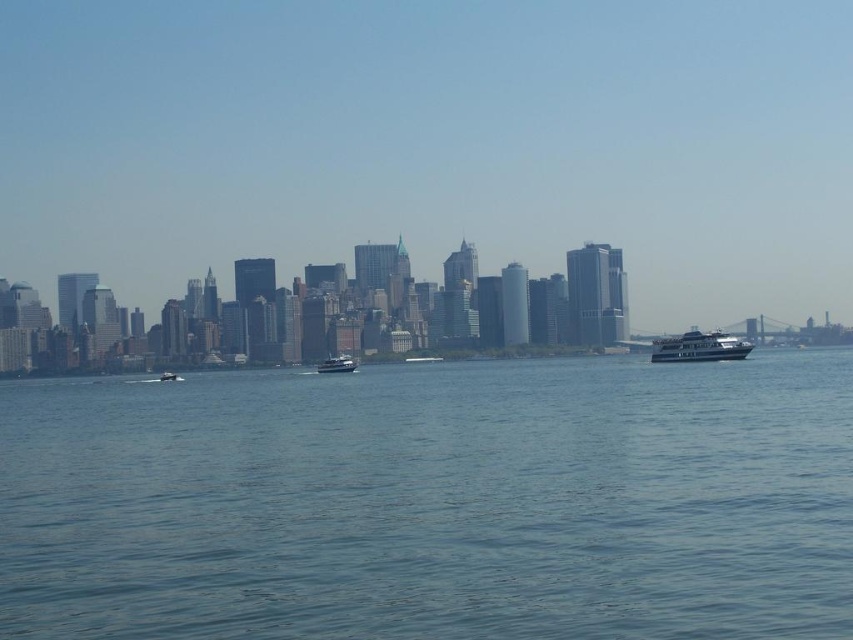
Can you confirm if white glossy ferry at right is taller than metallic silver boat at center-left?

Yes.

Which is in front, point (743, 353) or point (161, 372)?

Point (743, 353) is more forward.

Identify the location of white glossy ferry at right. (699, 348).

The width and height of the screenshot is (853, 640). Identify the location of white glossy ferry at right. (699, 348).

Is point (173, 388) in front of point (329, 369)?

Yes.

Does point (381, 504) come farther from viewer compared to point (341, 368)?

No.

Identify the location of blue water at center. (433, 502).

Does metallic silver boat at center come in front of metallic silver boat at center-left?

Yes, it is in front of metallic silver boat at center-left.

Does point (321, 368) come in front of point (167, 381)?

That is True.

This screenshot has height=640, width=853. I want to click on metallic silver boat at center, so click(337, 364).